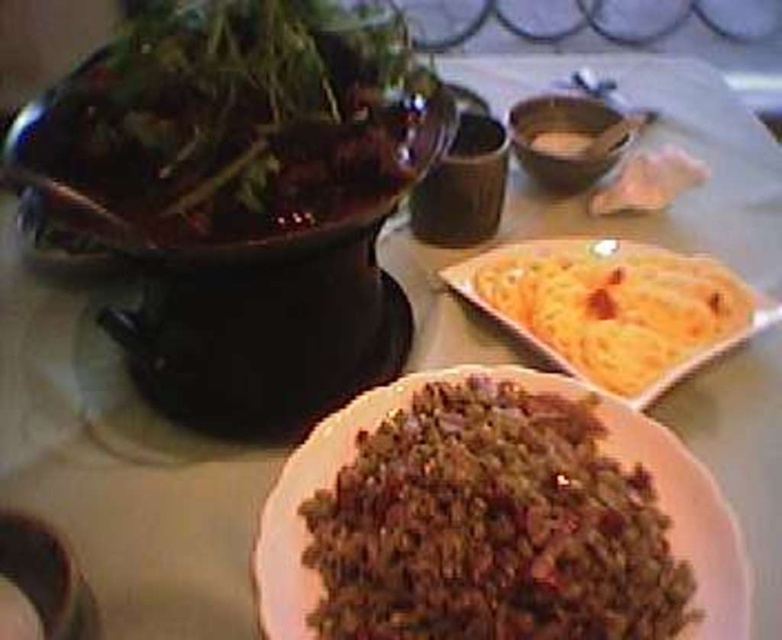
Question: Which point is closer to the camera taking this photo?

Choices:
 (A) (479, 422)
 (B) (536, 168)
 (C) (597, 282)

Answer: (A)

Question: Is brown matte ground beef at lower center positioned before matte brown bowl at upper center?

Choices:
 (A) yes
 (B) no

Answer: (A)

Question: Which object is the farthest from the yellow crispy flatbread at upper right?

Choices:
 (A) brown matte ground beef at lower center
 (B) matte brown bowl at upper center
 (C) white matte flatbread at upper right

Answer: (C)

Question: Which point is closer to the camera taking this photo?

Choices:
 (A) (546, 611)
 (B) (592, 307)

Answer: (A)

Question: Is matte brown bowl at upper center closer to the viewer compared to white matte flatbread at upper right?

Choices:
 (A) no
 (B) yes

Answer: (B)

Question: Considering the relative positions of brown matte ground beef at lower center and white matte flatbread at upper right in the image provided, where is brown matte ground beef at lower center located with respect to white matte flatbread at upper right?

Choices:
 (A) below
 (B) above

Answer: (A)